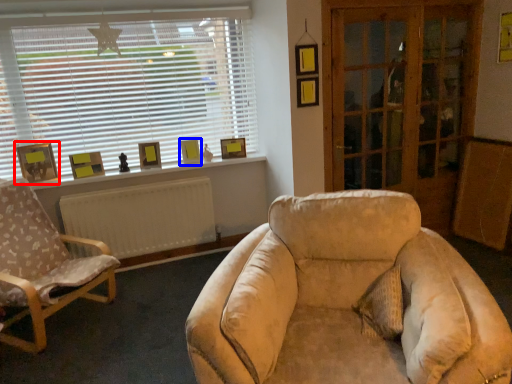
Question: Which object is further to the camera taking this photo, picture frame (highlighted by a red box) or picture frame (highlighted by a blue box)?

Choices:
 (A) picture frame
 (B) picture frame

Answer: (B)